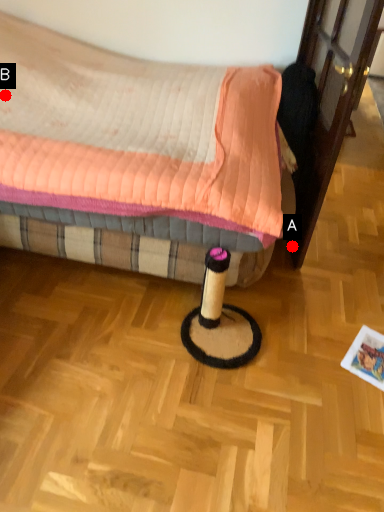
Question: Two points are circled on the image, labeled by A and B beside each circle. Which point is closer to the camera?

Choices:
 (A) A is closer
 (B) B is closer

Answer: (B)